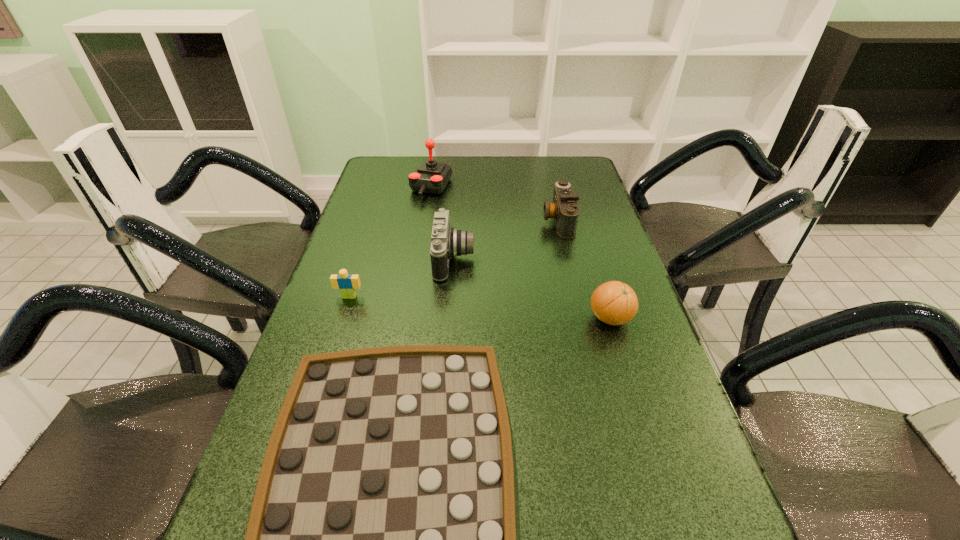
Locate an element on the screen. Image resolution: width=960 pixels, height=540 pixels. free location located on the left of the fifth farthest object is located at coordinates (433, 319).

Image resolution: width=960 pixels, height=540 pixels. Identify the location of free point located 0.170m on the lens of the shorter camera. [x=488, y=220].

This screenshot has width=960, height=540. I want to click on blank area located 0.350m on the lens of the shorter camera, so click(x=430, y=220).

Identify the location of vacant area located on the lens of the shorter camera. Image resolution: width=960 pixels, height=540 pixels. (504, 220).

I want to click on free region located 0.050m on the face of the third nearest object, so click(x=344, y=314).

This screenshot has height=540, width=960. Find the location of `object that is at the far edge`. object that is at the far edge is located at coordinates (431, 177).

Where is `joystick that is at the left edge`? The width and height of the screenshot is (960, 540). joystick that is at the left edge is located at coordinates (431, 177).

Where is `Lego situated at the left edge`? Lego situated at the left edge is located at coordinates (347, 284).

Locate an element on the screen. This screenshot has height=540, width=960. orange that is at the right edge is located at coordinates (614, 303).

Identify the location of camera at the right edge. The width and height of the screenshot is (960, 540). (564, 209).